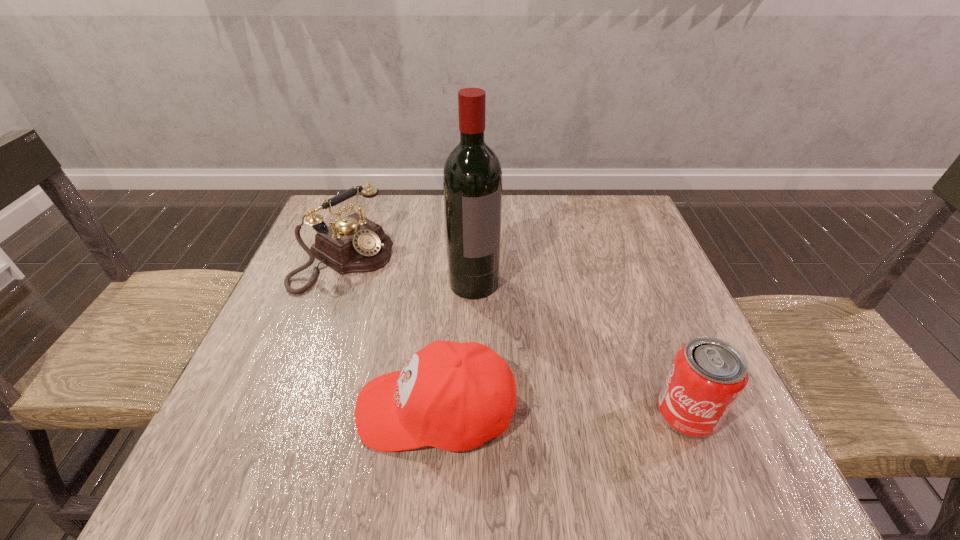
Where is `vacant space situated on the label of the tallest object`? This screenshot has height=540, width=960. vacant space situated on the label of the tallest object is located at coordinates (497, 315).

Identify the location of free region located 0.330m on the dial of the telephone. (482, 349).

The height and width of the screenshot is (540, 960). What are the coordinates of `free space located 0.260m on the dial of the telephone` in the screenshot? It's located at (456, 333).

Find the location of `vacant region located on the dial of the telephone`. vacant region located on the dial of the telephone is located at coordinates (439, 321).

The height and width of the screenshot is (540, 960). Identify the location of object present at the far edge. (354, 244).

Locate an element on the screen. This screenshot has width=960, height=540. baseball cap located in the near edge section of the desktop is located at coordinates (454, 396).

Locate an element on the screen. can located in the near edge section of the desktop is located at coordinates (707, 376).

Find the location of a particular element. This screenshot has height=540, width=960. object that is positioned at the left edge is located at coordinates pyautogui.click(x=354, y=244).

Find the location of a particular element. The height and width of the screenshot is (540, 960). object that is at the right edge is located at coordinates (707, 376).

Where is `object situated at the far left corner`? object situated at the far left corner is located at coordinates (354, 244).